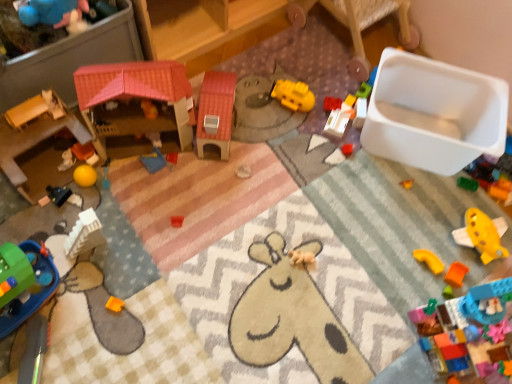
Where is `space that is in front of white plastic container at center, acting as the 10th toy starting from the left`? space that is in front of white plastic container at center, acting as the 10th toy starting from the left is located at coordinates (333, 167).